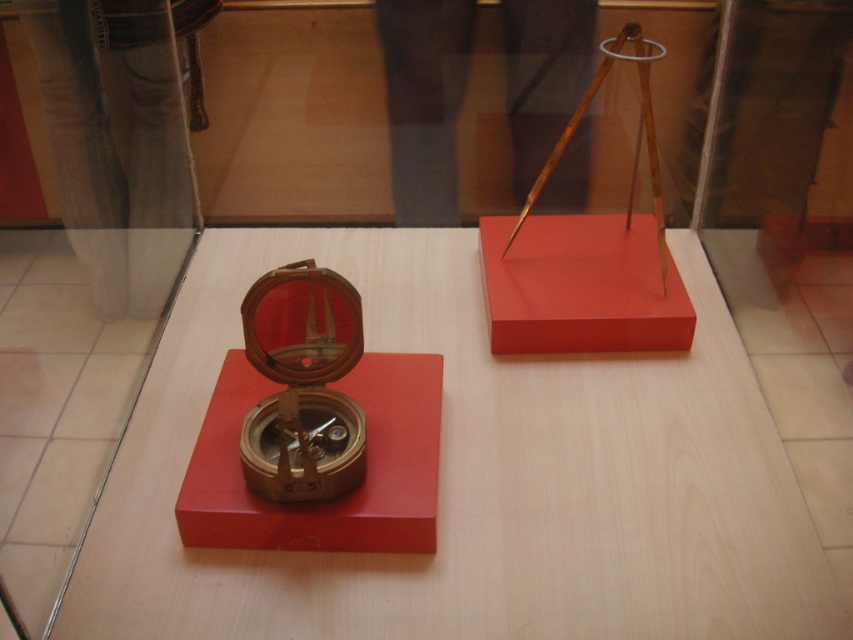
You are a museum curator checking the display case. You need to determine which object is shorter between the brass compass at center and the wooden compass at center. Which one is shorter?

The brass compass at center is not as tall as the wooden compass at center, so the brass compass at center is shorter.

You are a museum visitor looking at the two compasses in the glass case. The brass compass at center and the wooden compass at center. Which one is positioned lower in the case?

The brass compass at center is positioned lower in the case than the wooden compass at center.